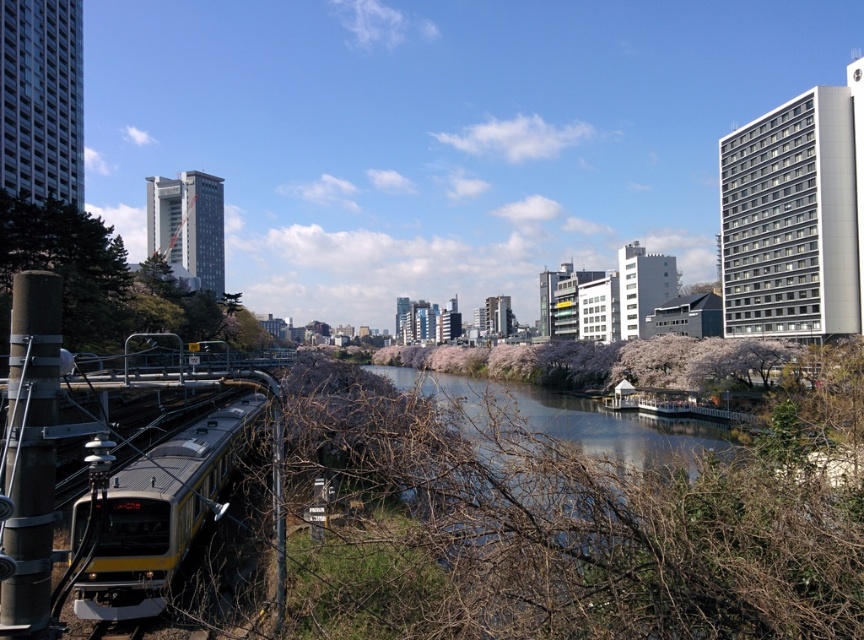
You are standing at the point with coordinates (162, 513). What object are you standing on?

You are standing on the yellow metallic train at lower left.

You are a photographer standing at the center of the scene. You want to capture a photo that includes both the yellow metallic train at lower left and the green leafy tree at left. Which object should you adjust your camera angle to focus on first to ensure both are in frame?

The yellow metallic train at lower left is thinner than the green leafy tree at left, so you should focus on the wider green leafy tree at left first to ensure both fit in the frame.

You are a pedestrian standing on the platform waiting for the train. You notice the yellow metallic train at lower left and the green leafy tree at left. Which object is closer to the ground level?

The yellow metallic train at lower left is located below green leafy tree at left, so the yellow metallic train at lower left is closer to the ground level.